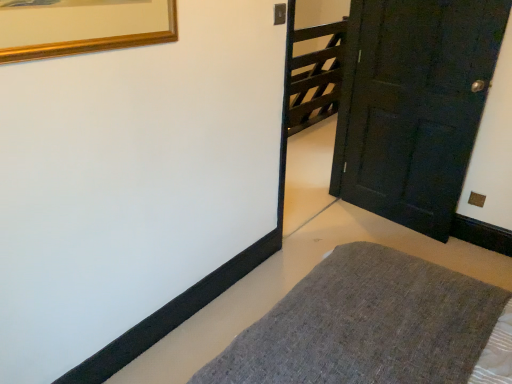
Question: Is dark wood gate at upper right smaller than matte black door at right?

Choices:
 (A) no
 (B) yes

Answer: (A)

Question: From the image's perspective, is dark wood gate at upper right below matte black door at right?

Choices:
 (A) yes
 (B) no

Answer: (B)

Question: From the image's perspective, is dark wood gate at upper right on top of matte black door at right?

Choices:
 (A) yes
 (B) no

Answer: (A)

Question: Is matte black door at right at the back of dark wood gate at upper right?

Choices:
 (A) no
 (B) yes

Answer: (A)

Question: Does dark wood gate at upper right turn towards matte black door at right?

Choices:
 (A) yes
 (B) no

Answer: (B)

Question: Would you say textured gray rug at lower center is to the left or to the right of dark wood gate at upper right in the picture?

Choices:
 (A) right
 (B) left

Answer: (B)

Question: In terms of height, does textured gray rug at lower center look taller or shorter compared to dark wood gate at upper right?

Choices:
 (A) short
 (B) tall

Answer: (A)

Question: Considering the positions of point (381, 350) and point (303, 87), is point (381, 350) closer or farther from the camera than point (303, 87)?

Choices:
 (A) farther
 (B) closer

Answer: (B)

Question: From a real-world perspective, is textured gray rug at lower center physically located above or below dark wood gate at upper right?

Choices:
 (A) below
 (B) above

Answer: (A)

Question: From the image's perspective, is textured gray rug at lower center positioned above or below matte black door at right?

Choices:
 (A) above
 (B) below

Answer: (B)

Question: Based on their sizes in the image, would you say textured gray rug at lower center is bigger or smaller than matte black door at right?

Choices:
 (A) big
 (B) small

Answer: (A)

Question: Considering the positions of point [334, 327] and point [428, 142], is point [334, 327] closer or farther from the camera than point [428, 142]?

Choices:
 (A) closer
 (B) farther

Answer: (A)

Question: Is textured gray rug at lower center taller or shorter than matte black door at right?

Choices:
 (A) short
 (B) tall

Answer: (A)

Question: Considering their positions, is matte black door at right located in front of or behind dark wood gate at upper right?

Choices:
 (A) front
 (B) behind

Answer: (A)

Question: Do you think matte black door at right is within dark wood gate at upper right, or outside of it?

Choices:
 (A) outside
 (B) inside

Answer: (A)